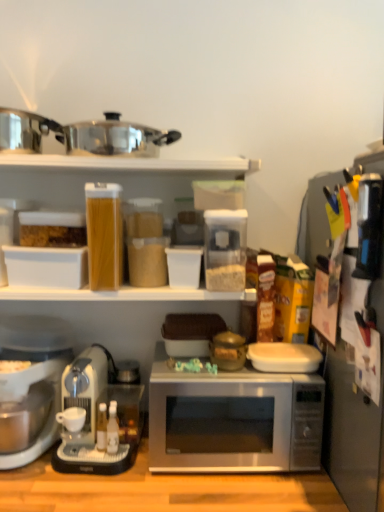
Question: Considering the relative positions of white matte coffee cup at lower left and sleek silver coffee maker at lower left, acting as the first coffee maker starting from the right, in the image provided, is white matte coffee cup at lower left to the left of sleek silver coffee maker at lower left, acting as the first coffee maker starting from the right, from the viewer's perspective?

Choices:
 (A) no
 (B) yes

Answer: (B)

Question: Is the position of white matte coffee cup at lower left less distant than that of sleek silver coffee maker at lower left, the second coffee maker positioned from the left?

Choices:
 (A) no
 (B) yes

Answer: (A)

Question: Does white matte coffee cup at lower left appear on the right side of sleek silver coffee maker at lower left, the second coffee maker positioned from the left?

Choices:
 (A) no
 (B) yes

Answer: (A)

Question: Are white matte coffee cup at lower left and sleek silver coffee maker at lower left, acting as the first coffee maker starting from the right, beside each other?

Choices:
 (A) yes
 (B) no

Answer: (A)

Question: From the image's perspective, does white matte coffee cup at lower left appear higher than sleek silver coffee maker at lower left, the second coffee maker positioned from the left?

Choices:
 (A) yes
 (B) no

Answer: (B)

Question: Considering the relative sizes of white matte coffee cup at lower left and sleek silver coffee maker at lower left, the second coffee maker positioned from the left, in the image provided, is white matte coffee cup at lower left taller than sleek silver coffee maker at lower left, the second coffee maker positioned from the left,?

Choices:
 (A) no
 (B) yes

Answer: (A)

Question: Considering the relative sizes of white plastic coffee maker at lower left, which is the 1th coffee maker from left to right, and shiny metallic pot at upper center in the image provided, is white plastic coffee maker at lower left, which is the 1th coffee maker from left to right, thinner than shiny metallic pot at upper center?

Choices:
 (A) yes
 (B) no

Answer: (B)

Question: Could you tell me if white plastic coffee maker at lower left, the second coffee maker from the right, is turned towards shiny metallic pot at upper center?

Choices:
 (A) no
 (B) yes

Answer: (A)

Question: Is white plastic coffee maker at lower left, the second coffee maker from the right, wider than shiny metallic pot at upper center?

Choices:
 (A) no
 (B) yes

Answer: (B)

Question: From the image's perspective, is white plastic coffee maker at lower left, which is the 1th coffee maker from left to right, under shiny metallic pot at upper center?

Choices:
 (A) yes
 (B) no

Answer: (A)

Question: From a real-world perspective, is white plastic coffee maker at lower left, which is the 1th coffee maker from left to right, on shiny metallic pot at upper center?

Choices:
 (A) yes
 (B) no

Answer: (B)

Question: Does white plastic coffee maker at lower left, which is the 1th coffee maker from left to right, appear on the left side of shiny metallic pot at upper center?

Choices:
 (A) yes
 (B) no

Answer: (A)

Question: Considering the relative sizes of black plastic knife block at right, the second appliance positioned from the left, and black plastic knife block at right, marked as the first appliance in a right-to-left arrangement, in the image provided, is black plastic knife block at right, the second appliance positioned from the left, shorter than black plastic knife block at right, marked as the first appliance in a right-to-left arrangement,?

Choices:
 (A) yes
 (B) no

Answer: (A)